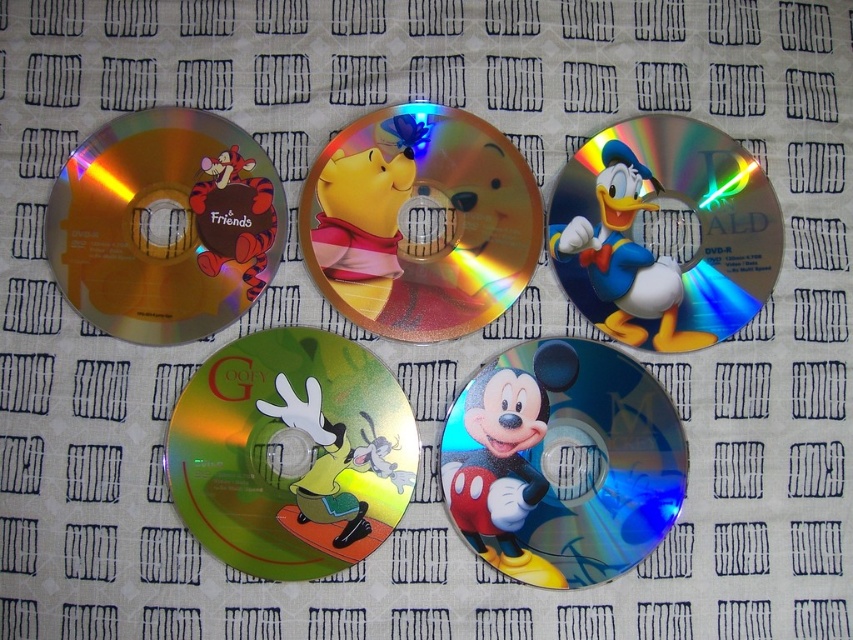
You are standing 1.2 meters away from the green shiny goofy at center. Can you reach it without moving closer?

The distance between you and the green shiny goofy at center is 1.14 meters, so yes, you can reach it without moving closer since you are only 1.2 meters away.

You are standing at a distance of 4 feet from the DVDs. Can you reach the DVD at point (228, 141) without moving your feet?

The distance between you and the DVD at point (228, 141) is 3.91 feet, which is slightly less than your 4 feet standing distance. Therefore, you can reach it without moving your feet.

You are standing in front of the DVDs and want to pick up the disc that is closer to you. Which disc should you choose between the one at point (x=190, y=497) and the one at point (x=625, y=337)?

The disc at point (x=190, y=497) is closer to you because it is in front of the disc at point (x=625, y=337).